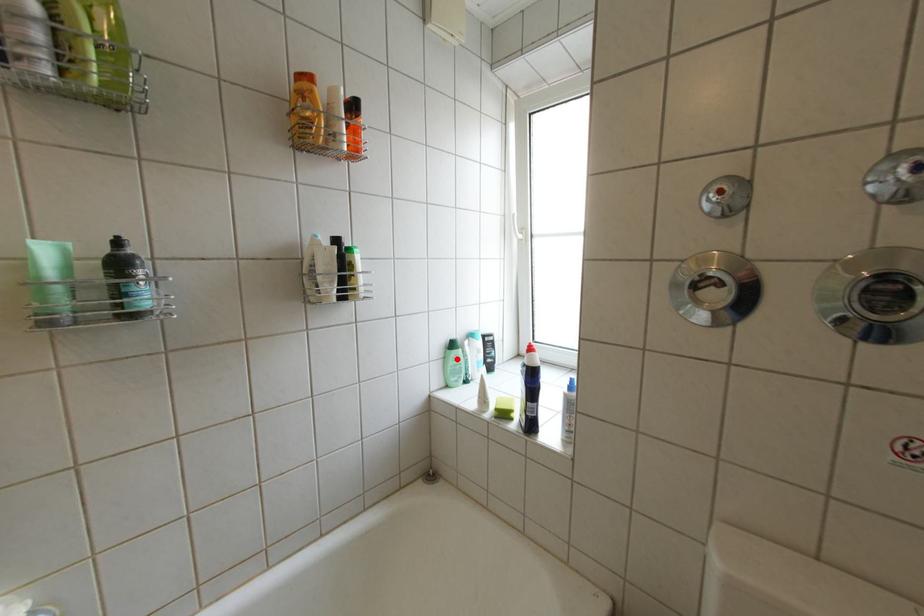
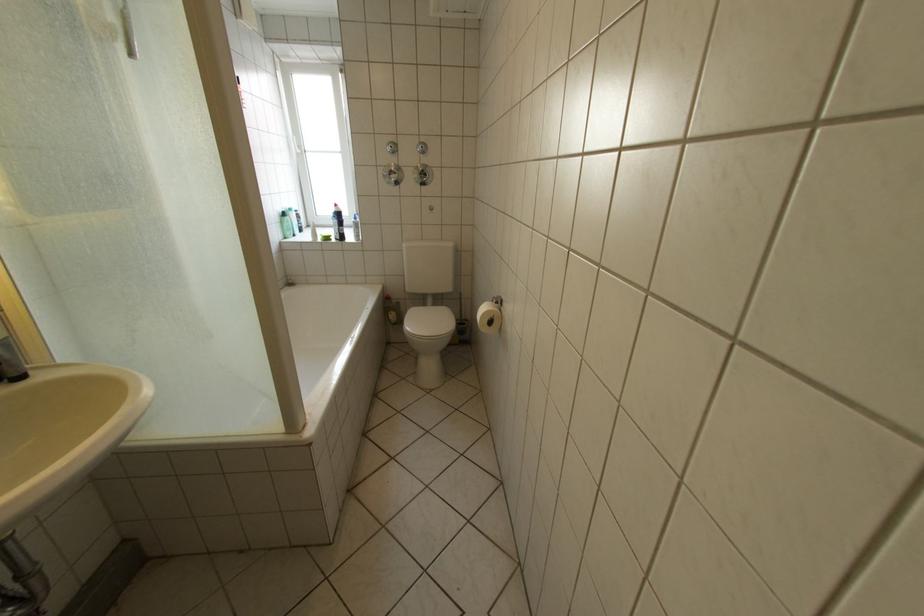
Question: I am providing you with two images of the same scene from different viewpoints. In image1, a red point is highlighted. Considering the same 3D point in image2, which of the following is correct?

Choices:
 (A) It is closer
 (B) It is farther

Answer: (A)